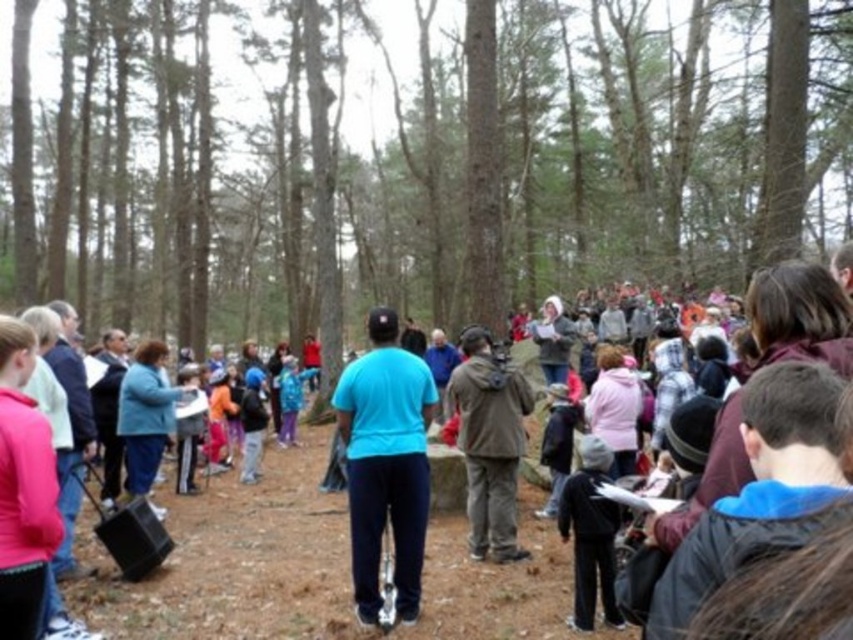
Is point (525, 388) less distant than point (152, 444)?

That is True.

Is brown fabric camera at center to the left of blue fleece jacket at center from the viewer's perspective?

In fact, brown fabric camera at center is to the right of blue fleece jacket at center.

Find the location of a particular element. The width and height of the screenshot is (853, 640). brown fabric camera at center is located at coordinates point(489,444).

Identify the location of brown fabric camera at center. (489, 444).

Who is taller, blue matte shirt at center or dark gray fleece jacket at lower center?

With more height is blue matte shirt at center.

Does blue matte shirt at center have a greater height compared to dark gray fleece jacket at lower center?

Indeed, blue matte shirt at center has a greater height compared to dark gray fleece jacket at lower center.

Who is more distant from viewer, (372, 500) or (610, 548)?

The point (372, 500) is behind.

At what (x,y) coordinates should I click in order to perform the action: click on blue matte shirt at center. Please return your answer as a coordinate pair (x, y). The image size is (853, 640). Looking at the image, I should click on (386, 464).

Does brown textured tree at center have a smaller size compared to blue cotton shirt at center?

Incorrect, brown textured tree at center is not smaller in size than blue cotton shirt at center.

Between brown textured tree at center and blue cotton shirt at center, which one has more height?

Standing taller between the two is brown textured tree at center.

Image resolution: width=853 pixels, height=640 pixels. What are the coordinates of `brown textured tree at center` in the screenshot? It's located at (415, 163).

Where is `brown textured tree at center`? This screenshot has height=640, width=853. brown textured tree at center is located at coordinates (415, 163).